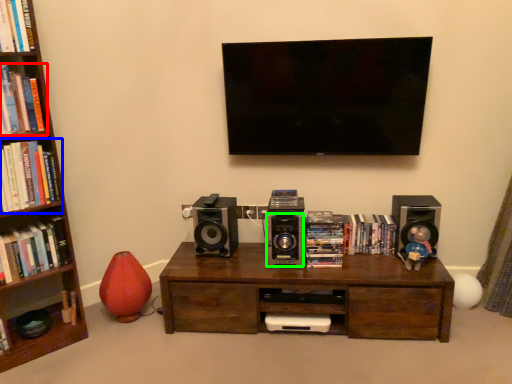
Question: Considering the real-world distances, which object is farthest from book (highlighted by a red box)? book (highlighted by a blue box) or speaker (highlighted by a green box)?

Choices:
 (A) book
 (B) speaker

Answer: (B)